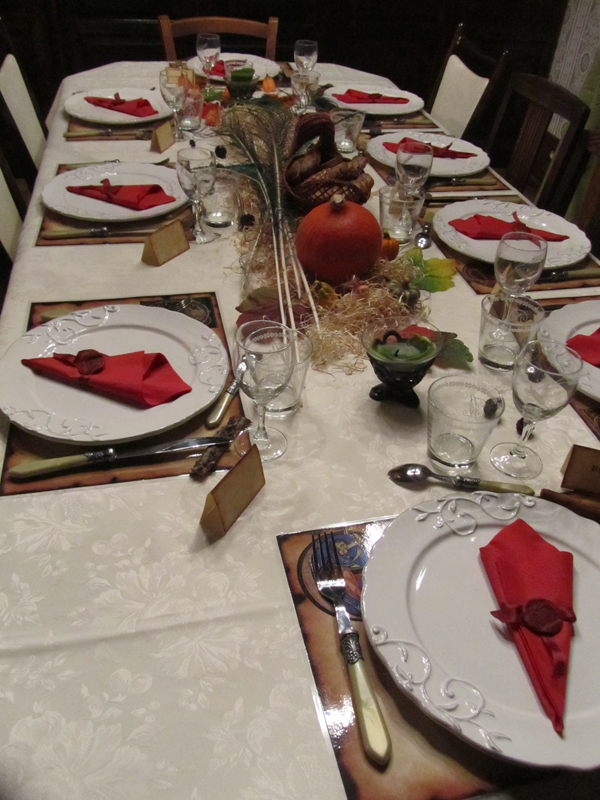
In order to click on placecards in this screenshot , I will do click(235, 494), click(582, 468), click(164, 242), click(164, 138).